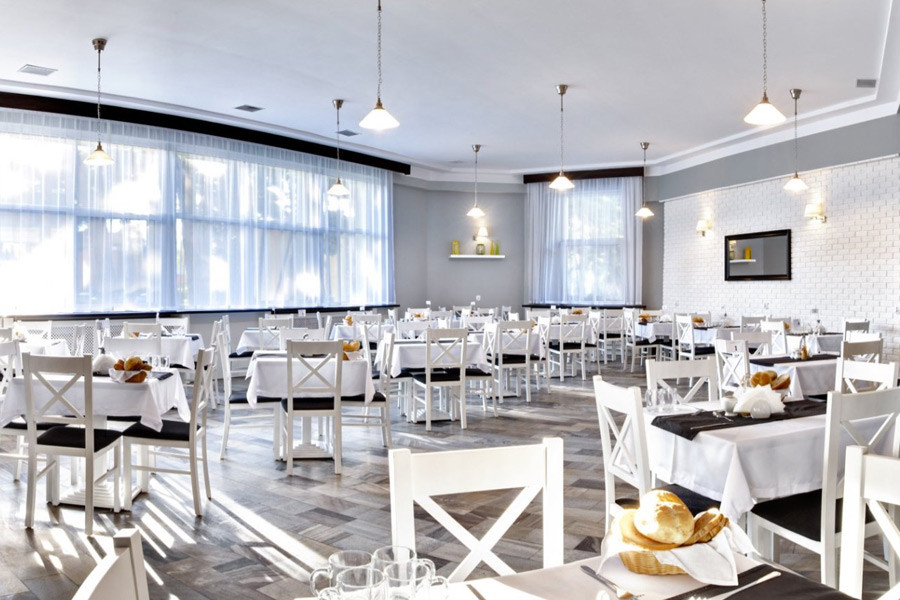
Locate an element on the screen. The width and height of the screenshot is (900, 600). bread basket is located at coordinates (660, 520), (760, 380), (787, 324), (699, 319), (645, 314), (577, 308), (418, 313), (346, 317), (352, 346), (132, 365).